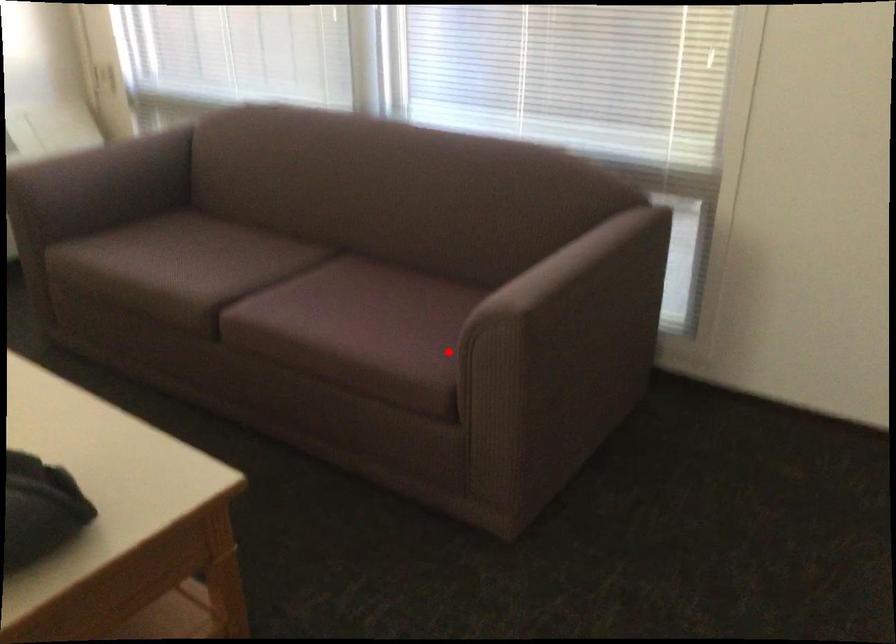
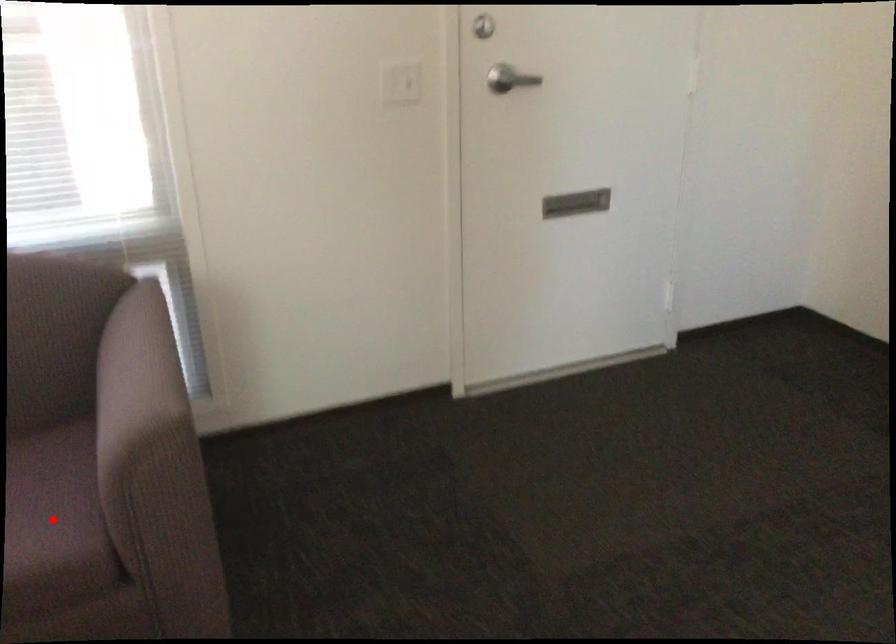
I am providing you with two images of the same scene from different viewpoints. A red point is marked on the first image and another point is marked on the second image. Do the highlighted points in image1 and image2 indicate the same real-world spot?

Yes